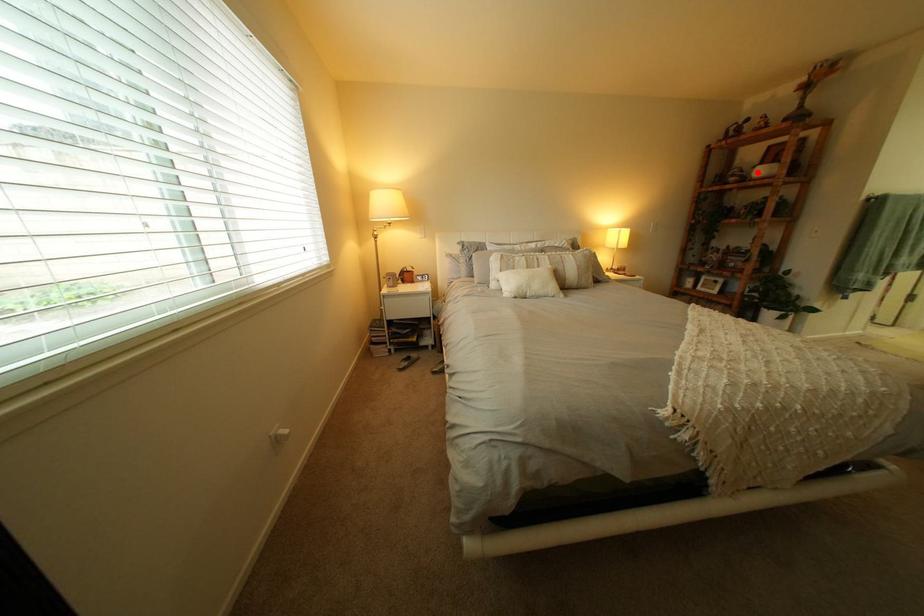
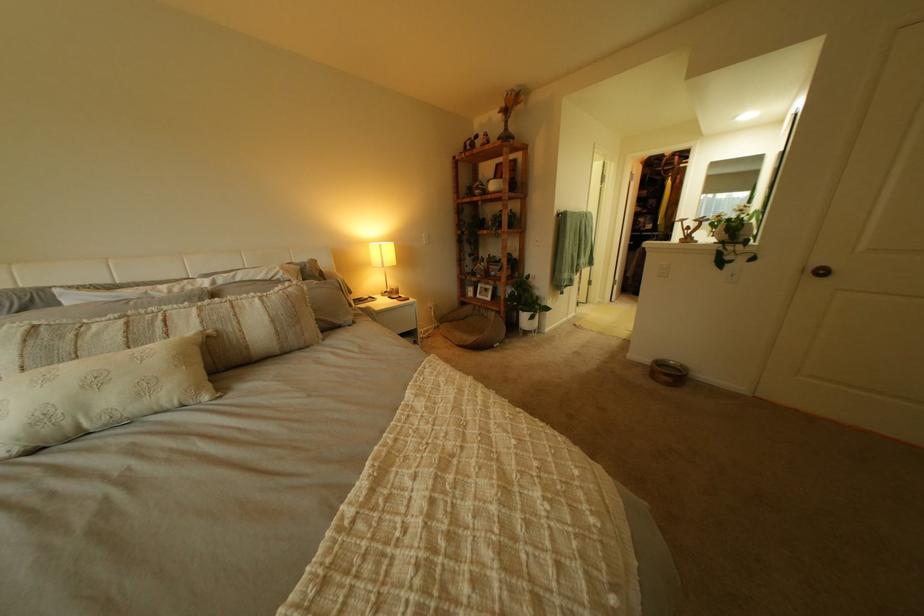
Question: A red point is marked in image1. In image2, is the corresponding 3D point closer to the camera or farther? Reply with the corresponding letter.

Choices:
 (A) The corresponding 3D point is closer.
 (B) The corresponding 3D point is farther.

Answer: (A)